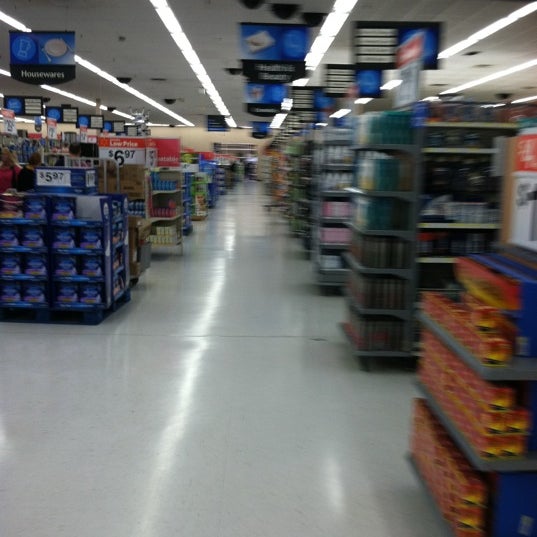
Find the location of a particular element. This screenshot has height=537, width=537. lights is located at coordinates (182, 46).